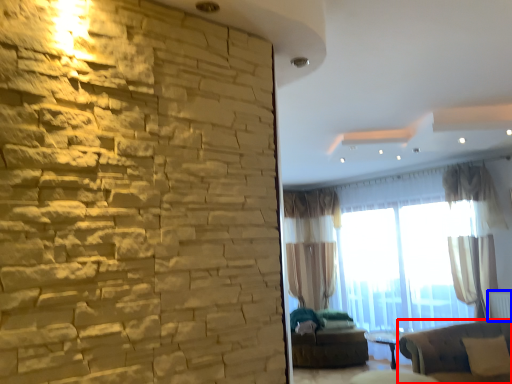
Question: Among these objects, which one is nearest to the camera, studio couch (highlighted by a red box) or radiator (highlighted by a blue box)?

Choices:
 (A) studio couch
 (B) radiator

Answer: (A)